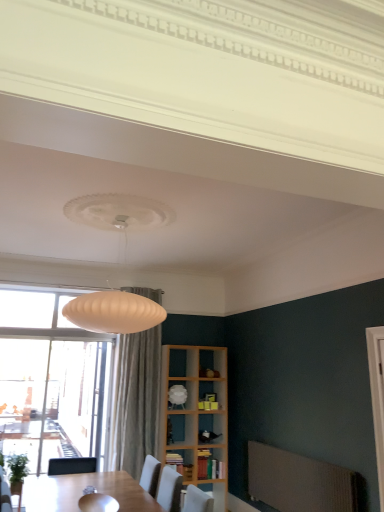
Question: Is white glossy shelf at center, the 2th shelf in the bottom-to-top sequence, turned away from white glossy screen door at right?

Choices:
 (A) yes
 (B) no

Answer: (B)

Question: Is white glossy shelf at center, the first shelf when ordered from top to bottom, aimed at white glossy screen door at right?

Choices:
 (A) yes
 (B) no

Answer: (A)

Question: From a real-world perspective, is white glossy shelf at center, the first shelf when ordered from top to bottom, positioned under white glossy screen door at right based on gravity?

Choices:
 (A) yes
 (B) no

Answer: (A)

Question: Does white glossy shelf at center, the first shelf when ordered from top to bottom, have a lesser width compared to white glossy screen door at right?

Choices:
 (A) yes
 (B) no

Answer: (B)

Question: Is white glossy shelf at center, the first shelf when ordered from top to bottom, to the right of white glossy screen door at right from the viewer's perspective?

Choices:
 (A) yes
 (B) no

Answer: (B)

Question: Is white glossy shelf at center, the first shelf when ordered from top to bottom, taller than white glossy screen door at right?

Choices:
 (A) no
 (B) yes

Answer: (A)

Question: Is wooden bookshelf at lower center, the 2th shelf in the top-to-bottom sequence, looking in the opposite direction of wooden bookshelf at center?

Choices:
 (A) yes
 (B) no

Answer: (B)

Question: Is wooden bookshelf at lower center, the 2th shelf in the top-to-bottom sequence, far from wooden bookshelf at center?

Choices:
 (A) yes
 (B) no

Answer: (B)

Question: Considering the relative sizes of wooden bookshelf at lower center, the 2th shelf in the top-to-bottom sequence, and wooden bookshelf at center in the image provided, is wooden bookshelf at lower center, the 2th shelf in the top-to-bottom sequence, bigger than wooden bookshelf at center?

Choices:
 (A) yes
 (B) no

Answer: (B)

Question: Does wooden bookshelf at lower center, the 2th shelf in the top-to-bottom sequence, appear on the right side of wooden bookshelf at center?

Choices:
 (A) no
 (B) yes

Answer: (A)

Question: From the image's perspective, is wooden bookshelf at lower center, the 2th shelf in the top-to-bottom sequence, beneath wooden bookshelf at center?

Choices:
 (A) no
 (B) yes

Answer: (A)

Question: Are wooden bookshelf at lower center, positioned as the first shelf in bottom-to-top order, and wooden bookshelf at center beside each other?

Choices:
 (A) no
 (B) yes

Answer: (A)

Question: Does wooden bookshelf at center have a lesser width compared to wooden bookshelf at lower center, the 2th shelf in the top-to-bottom sequence?

Choices:
 (A) no
 (B) yes

Answer: (A)